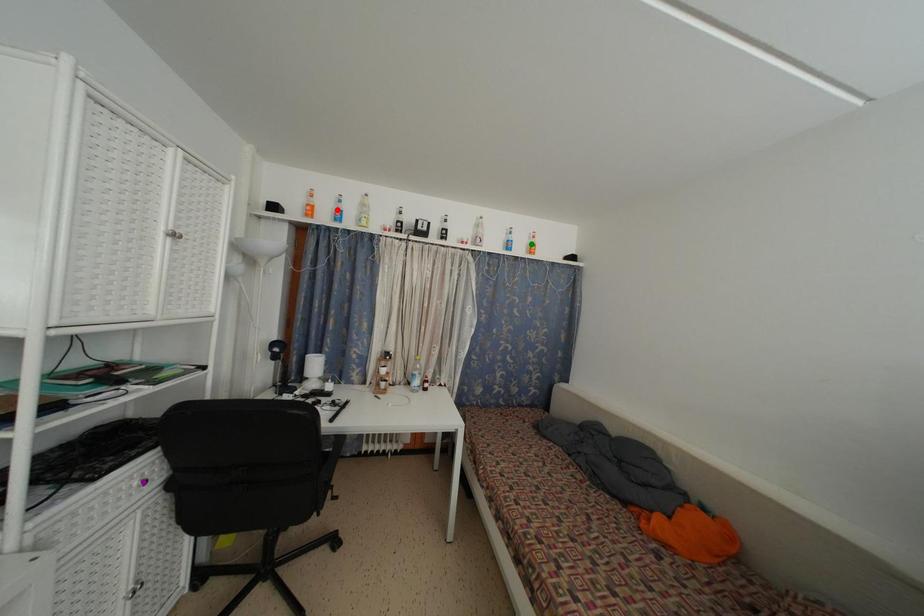
Order these from nearest to farthest:
purple point | green point | red point

green point < red point < purple point